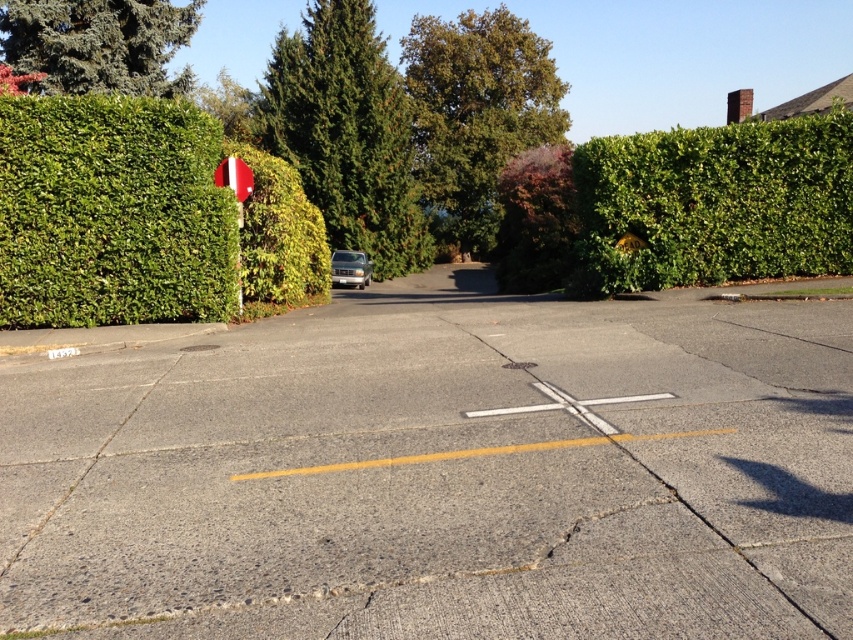
You are a pedestrian standing on the crosswalk in the image. You want to know which object, the green textured tree at upper center or the satin silver sedan at center, is taller. Which one is taller?

The green textured tree at upper center is taller than the satin silver sedan at center.

You are a pedestrian standing at the crosswalk on the road. You see a green textured tree at upper center and a satin silver sedan at center. Which object is higher up in the image?

The green textured tree at upper center is located above the satin silver sedan at center, so it is higher up in the image.

You are a pedestrian standing on the crosswalk in the image. You want to know which object, the green textured tree at upper center or the metallic pole at left, you can see more clearly from your current position. Based on their sizes, which one is more likely to be visible to you?

The green textured tree at upper center has a larger size compared to the metallic pole at left, so it is more likely to be visible from your current position on the crosswalk.